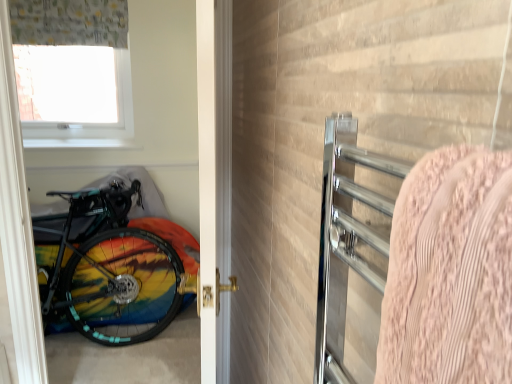
Question: Could you tell me if white glossy door at center is facing pink textured towel at right?

Choices:
 (A) no
 (B) yes

Answer: (A)

Question: Can you confirm if white glossy door at center is positioned to the right of pink textured towel at right?

Choices:
 (A) no
 (B) yes

Answer: (A)

Question: From a real-world perspective, is white glossy door at center beneath pink textured towel at right?

Choices:
 (A) no
 (B) yes

Answer: (B)

Question: Is white glossy door at center touching pink textured towel at right?

Choices:
 (A) no
 (B) yes

Answer: (A)

Question: Can you confirm if white glossy door at center is shorter than pink textured towel at right?

Choices:
 (A) no
 (B) yes

Answer: (A)

Question: Is point (53, 82) positioned closer to the camera than point (207, 86)?

Choices:
 (A) farther
 (B) closer

Answer: (A)

Question: From the image's perspective, relative to white glossy door at center, is transparent plastic window screen at upper left above or below?

Choices:
 (A) below
 (B) above

Answer: (B)

Question: Considering the positions of transparent plastic window screen at upper left and white glossy door at center in the image, is transparent plastic window screen at upper left bigger or smaller than white glossy door at center?

Choices:
 (A) big
 (B) small

Answer: (B)

Question: Considering the relative positions of transparent plastic window screen at upper left and white glossy door at center in the image provided, is transparent plastic window screen at upper left to the left or to the right of white glossy door at center?

Choices:
 (A) left
 (B) right

Answer: (A)

Question: In the image, is pink textured towel at right positioned in front of or behind patterned fabric curtain at upper left?

Choices:
 (A) front
 (B) behind

Answer: (A)

Question: Is pink textured towel at right to the left or to the right of patterned fabric curtain at upper left in the image?

Choices:
 (A) left
 (B) right

Answer: (B)

Question: Based on their sizes in the image, would you say pink textured towel at right is bigger or smaller than patterned fabric curtain at upper left?

Choices:
 (A) big
 (B) small

Answer: (B)

Question: In terms of height, does pink textured towel at right look taller or shorter compared to patterned fabric curtain at upper left?

Choices:
 (A) tall
 (B) short

Answer: (B)

Question: Considering the positions of rainbow painted bicycle at left and pink textured towel at right in the image, is rainbow painted bicycle at left bigger or smaller than pink textured towel at right?

Choices:
 (A) big
 (B) small

Answer: (A)

Question: From the image's perspective, relative to pink textured towel at right, is rainbow painted bicycle at left above or below?

Choices:
 (A) below
 (B) above

Answer: (A)